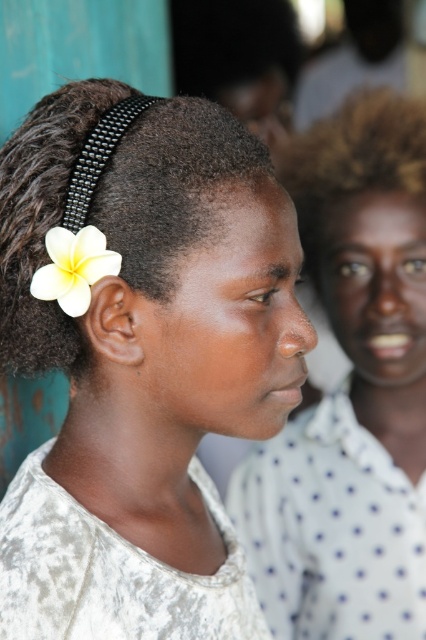
Question: Where is black beaded headband at left located in relation to white matte flower at left in the image?

Choices:
 (A) left
 (B) right

Answer: (A)

Question: Which point is farther to the camera?

Choices:
 (A) black beaded headband at left
 (B) matte white shirt at center

Answer: (B)

Question: Is white matte flower at upper left to the right of white matte flower at left from the viewer's perspective?

Choices:
 (A) no
 (B) yes

Answer: (B)

Question: Does white matte flower at upper left appear over black beaded headband at left?

Choices:
 (A) no
 (B) yes

Answer: (A)

Question: Which of the following is the closest to the observer?

Choices:
 (A) matte white shirt at center
 (B) white matte flower at upper left

Answer: (B)

Question: Which of the following is the farthest from the observer?

Choices:
 (A) (152, 134)
 (B) (373, 285)

Answer: (B)